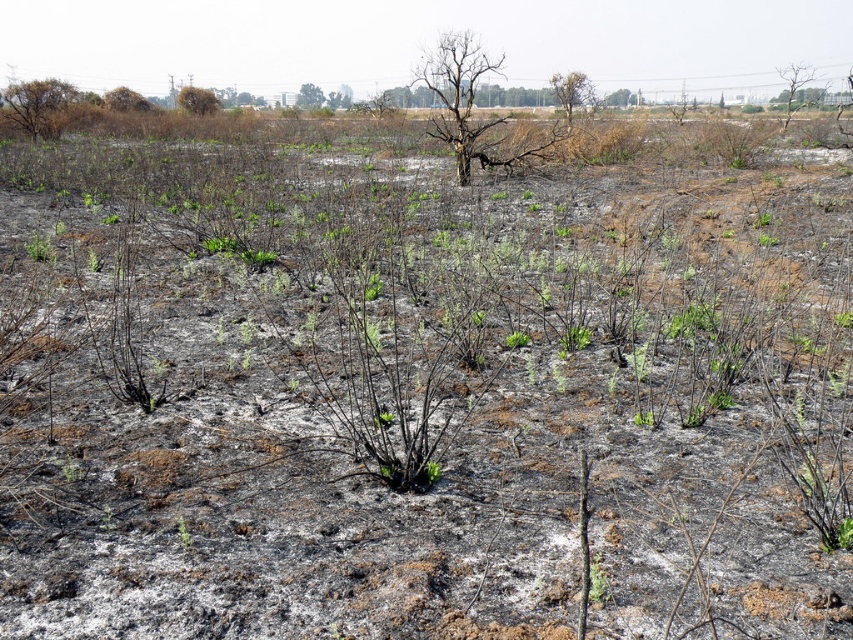
Who is positioned more to the right, burnt wood tree at upper left or charcoal-barked tree at upper right?

charcoal-barked tree at upper right

In the scene shown: Does burnt wood tree at upper left appear on the right side of charcoal-barked tree at upper right?

In fact, burnt wood tree at upper left is to the left of charcoal-barked tree at upper right.

This screenshot has width=853, height=640. I want to click on burnt wood tree at upper left, so click(x=39, y=106).

Which is behind, point (788, 116) or point (138, 97)?

The point (138, 97) is behind.

Measure the distance between charcoal-barked tree at upper right and brown charred tree at upper left.

33.69 meters

Who is more distant from viewer, (785, 115) or (137, 92)?

Point (137, 92)

Where is `charcoal-barked tree at upper right`? charcoal-barked tree at upper right is located at coordinates tap(793, 84).

Between point (51, 128) and point (114, 93), which one is positioned behind?

Positioned behind is point (114, 93).

You are a GUI agent. You are given a task and a screenshot of the screen. Output one action in this format:
    pyautogui.click(x=<x>, y=<y>)
    Task: Click on the burnt wood tree at upper left
    Image resolution: width=853 pixels, height=640 pixels.
    Given the screenshot: What is the action you would take?
    coord(39,106)